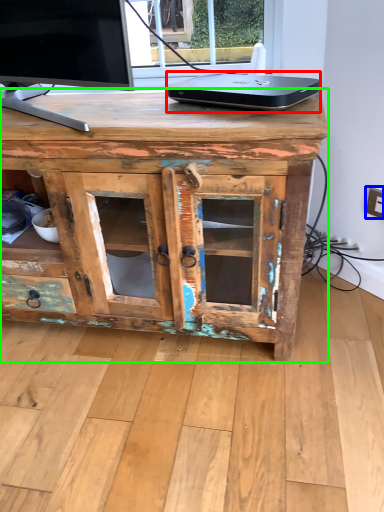
Question: Which object is positioned closest to laptop (highlighted by a red box)? Select from electric outlet (highlighted by a blue box) and desk (highlighted by a green box).

Choices:
 (A) electric outlet
 (B) desk

Answer: (B)